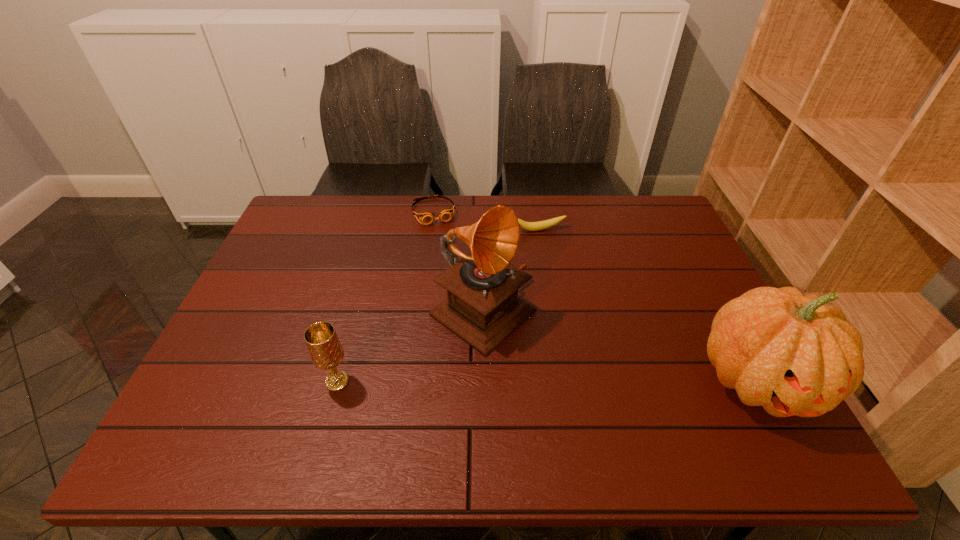
This screenshot has height=540, width=960. I want to click on vacant space that is in between the leftmost object and the tallest object, so click(410, 347).

In order to click on free area in between the shortest object and the chalice in this screenshot , I will do `click(385, 296)`.

The height and width of the screenshot is (540, 960). I want to click on free space between the pumpkin and the shortest object, so click(596, 296).

Find the location of a particular element. vacant area that lies between the tallest object and the leftmost object is located at coordinates (410, 347).

The image size is (960, 540). Find the location of `free space between the shortest object and the rightmost object`. free space between the shortest object and the rightmost object is located at coordinates (596, 296).

Find the location of `object that is the third closest to the leftmost object`. object that is the third closest to the leftmost object is located at coordinates (540, 225).

Locate which object is the closest to the tallest object. Please provide its 2D coordinates. Your answer should be formatted as a tuple, i.e. [(x, y)], where the tuple contains the x and y coordinates of a point satisfying the conditions above.

[(326, 352)]

You are a GUI agent. You are given a task and a screenshot of the screen. Output one action in this format:
    pyautogui.click(x=<x>, y=<y>)
    Task: Click on the vacant space that satisfies the following two spatial constraints: 1. on the back side of the tallest object; 2. on the left side of the third tallest object
    The image size is (960, 540).
    Given the screenshot: What is the action you would take?
    pyautogui.click(x=356, y=314)

The width and height of the screenshot is (960, 540). What are the coordinates of `vacant space that satisfies the following two spatial constraints: 1. on the front side of the goggles; 2. on the left side of the tallest object` in the screenshot? It's located at (420, 314).